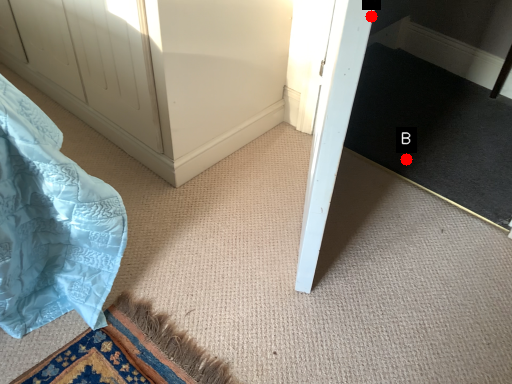
Question: Two points are circled on the image, labeled by A and B beside each circle. Which point appears closest to the camera in this image?

Choices:
 (A) A is closer
 (B) B is closer

Answer: (A)